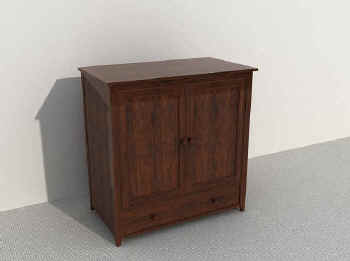
Where is `left door`? The height and width of the screenshot is (261, 350). left door is located at coordinates (147, 146).